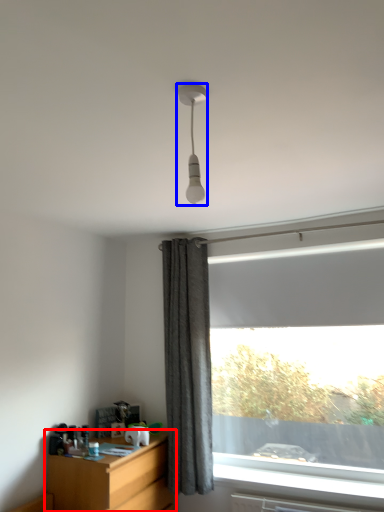
Question: Which object is further to the camera taking this photo, desk (highlighted by a red box) or lamp (highlighted by a blue box)?

Choices:
 (A) desk
 (B) lamp

Answer: (A)